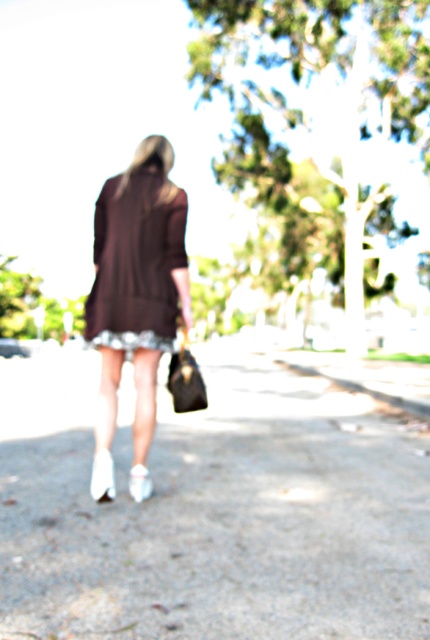
Question: Which object appears farthest from the camera in this image?

Choices:
 (A) white leather shoe at lower center
 (B) matte brown dress at center

Answer: (B)

Question: Which of the following is the farthest from the observer?

Choices:
 (A) white smooth pavement at center
 (B) matte brown coat at center
 (C) white leather boot at lower center
 (D) white leather shoe at lower center

Answer: (C)

Question: From the image, what is the correct spatial relationship of white leather shoe at lower center in relation to white leather boot at lower center?

Choices:
 (A) above
 (B) below

Answer: (A)

Question: Is matte brown dress at center wider than white leather boot at lower center?

Choices:
 (A) yes
 (B) no

Answer: (A)

Question: Is white smooth pavement at center bigger than white leather boot at lower center?

Choices:
 (A) no
 (B) yes

Answer: (B)

Question: Which is farther from the matte brown dress at center?

Choices:
 (A) white leather boot at lower center
 (B) white leather shoe at lower center
 (C) matte brown coat at center

Answer: (A)